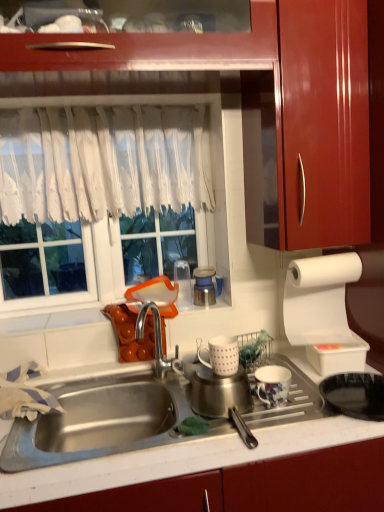
Identify the location of free space above black matte frying pan at lower right (from a real-world perspective). (360, 381).